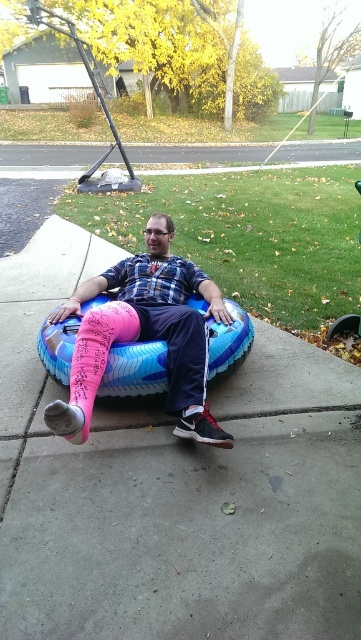
You are a physical therapist observing a patient sitting on the blue rubber tube at center and noticing their pink matte prosthetic leg at lower left. Which object is positioned to the right side from your viewpoint?

The blue rubber tube at center is positioned to the right of the pink matte prosthetic leg at lower left.